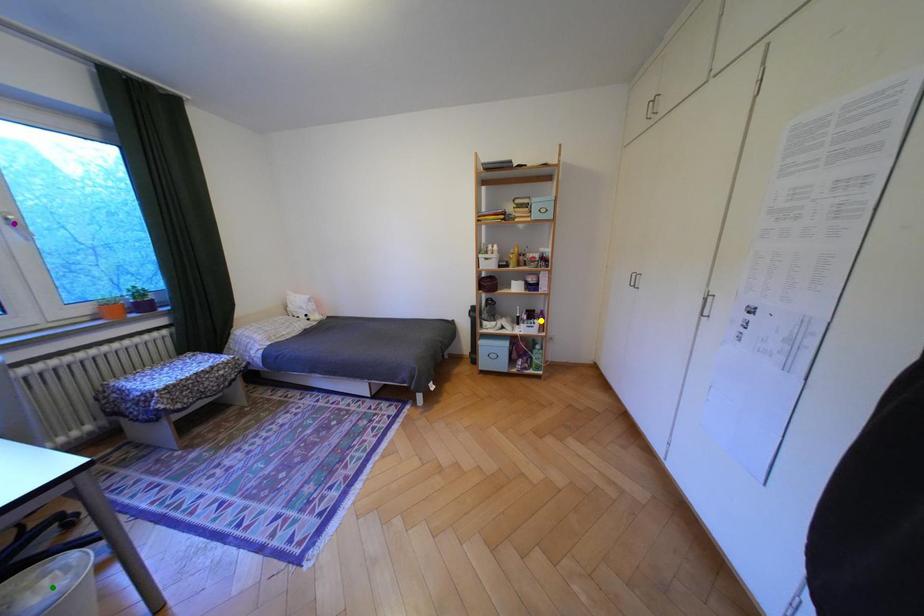
Order these from nearest to farthest:
1. purple point
2. green point
3. yellow point

purple point < yellow point < green point